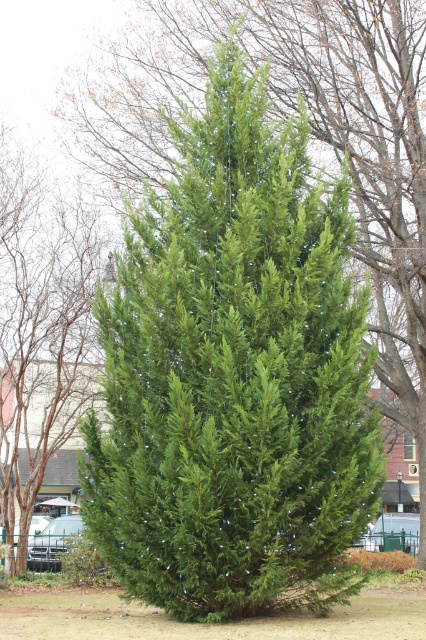
You are standing in a park and see the green matte fir tree at center and the green matte evergreen tree at center. Which tree is positioned to the right of the other?

The green matte fir tree at center is to the right of the green matte evergreen tree at center.

You are planning to place a bench in front of the green matte fir tree at center and the green matte evergreen tree at center. Which tree requires a wider bench to accommodate its base?

The green matte fir tree at center requires a wider bench because its width surpasses that of the green matte evergreen tree at center.

You are a landscape architect designing a garden and need to place both the green matte fir tree at center and the green matte evergreen tree at center. Which tree should you choose if you want the taller one in the garden?

The green matte fir tree at center is taller than the green matte evergreen tree at center, so you should choose the green matte fir tree at center for the taller option in the garden.